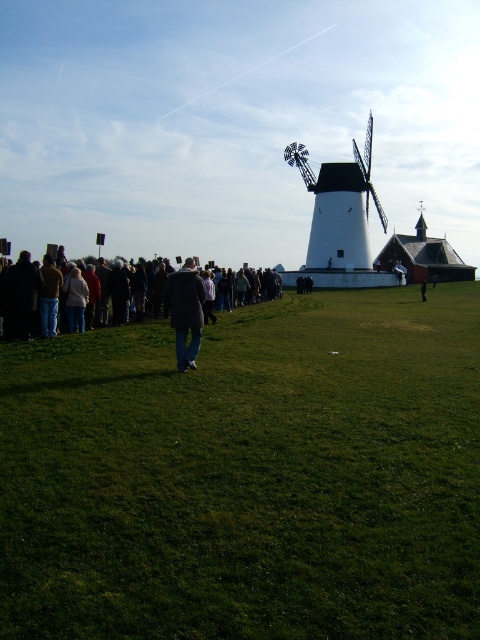
You are standing at the center of the image and want to walk to the green grassy field at lower center. Which direction should you move relative to your current position?

Since the green grassy field at lower center is located at coordinates approximately 0.744 on the x and 0.517 on the y axis, you should move downward and slightly to the right to reach it from the center of the image.

You are a photographer trying to capture a clear shot of the dark gray coat at center and jeans at center. Since you want both subjects to be clearly visible in your photo, which one should you focus on first to ensure it appears sharp?

The dark gray coat at center is larger in size than jeans at center, so you should focus on the dark gray coat at center first to ensure it appears sharp in the photo.

You are a photographer trying to capture a clear shot of the dark gray coat at center and the dark wool coat at center. However, you notice that one of the coats is blocking the view of the other. Which coat is blocking the view of the other?

The dark gray coat at center is positioned over dark wool coat at center, so the dark gray coat at center is blocking the view of the dark wool coat at center.